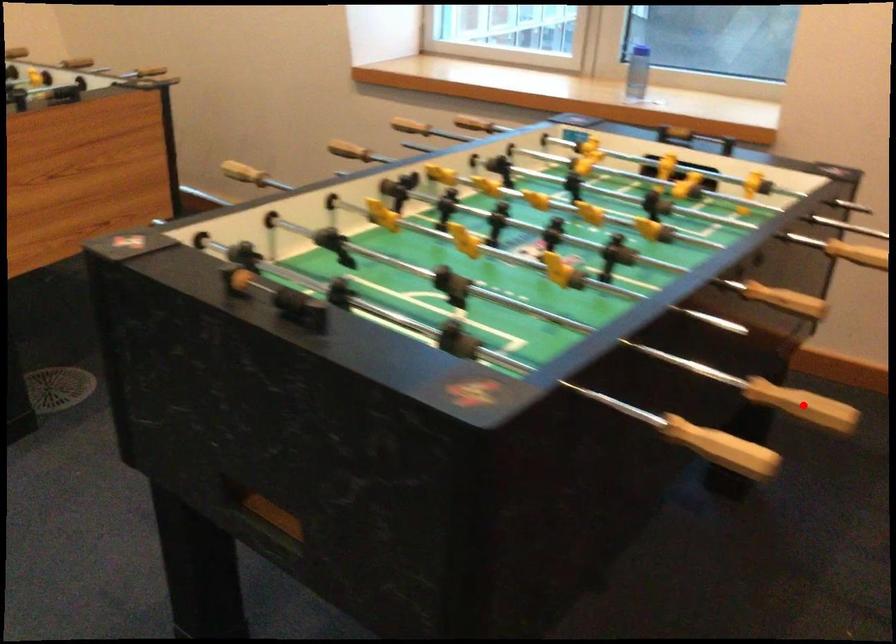
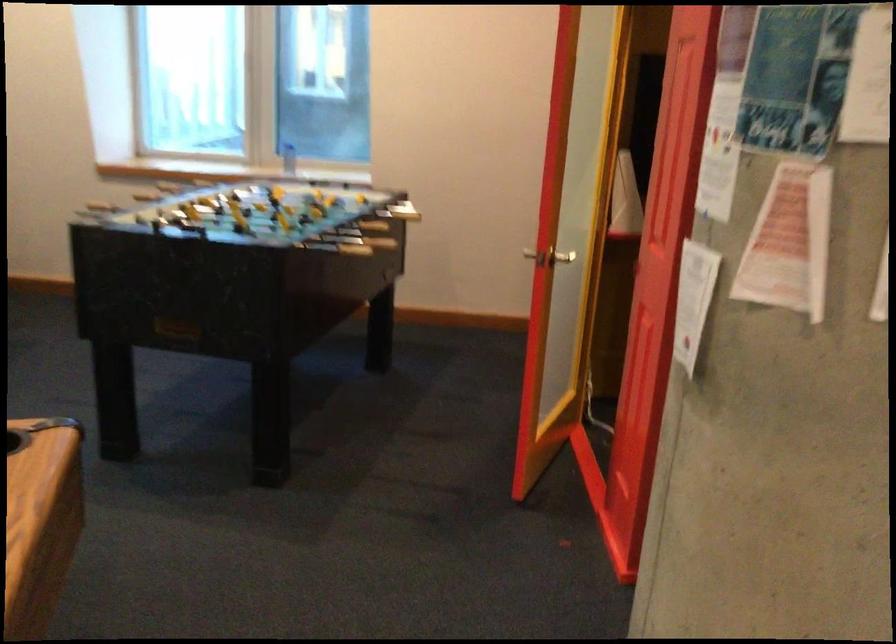
The point at the highlighted location is marked in the first image. Where is the corresponding point in the second image?

(381, 229)